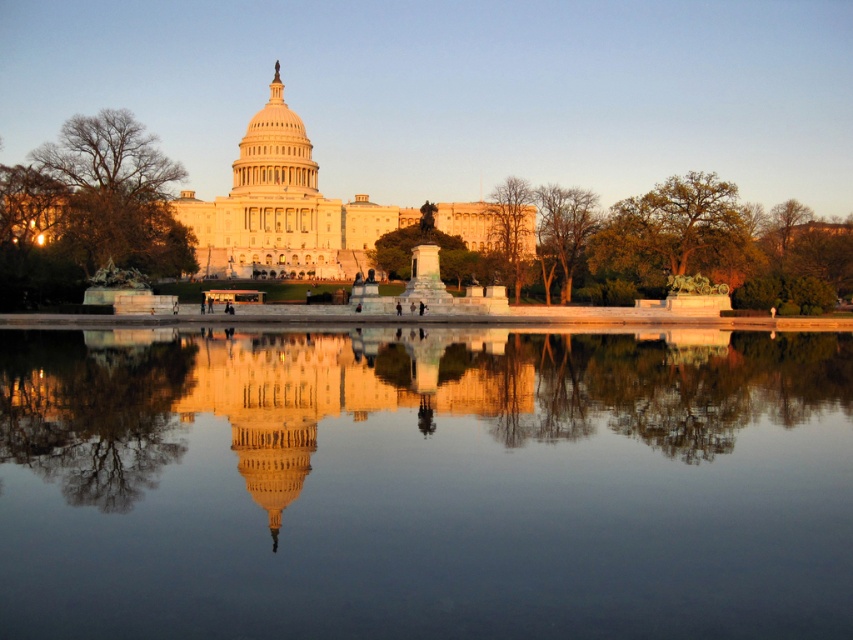
Does bare branches at center have a lesser width compared to green leafy tree at center?

No, bare branches at center is not thinner than green leafy tree at center.

Who is more distant from viewer, (546,275) or (521,237)?

Point (521,237)

Which is in front, point (572, 230) or point (518, 212)?

Point (572, 230) is in front.

Locate an element on the screen. This screenshot has width=853, height=640. bare branches at center is located at coordinates (563, 228).

Between point (148, 234) and point (515, 248), which one is positioned behind?

Positioned behind is point (515, 248).

Can you confirm if bare branches at left is smaller than green leafy tree at center?

Incorrect, bare branches at left is not smaller in size than green leafy tree at center.

Who is more distant from viewer, (x=26, y=198) or (x=492, y=193)?

Point (x=492, y=193)

In order to click on bare branches at left in this screenshot , I will do `click(99, 196)`.

Is transparent glass water at center behind green leafy tree at right?

No, it is not.

Where is `transparent glass water at center`? The image size is (853, 640). transparent glass water at center is located at coordinates (424, 483).

Where is `transparent glass water at center`? This screenshot has height=640, width=853. transparent glass water at center is located at coordinates (424, 483).